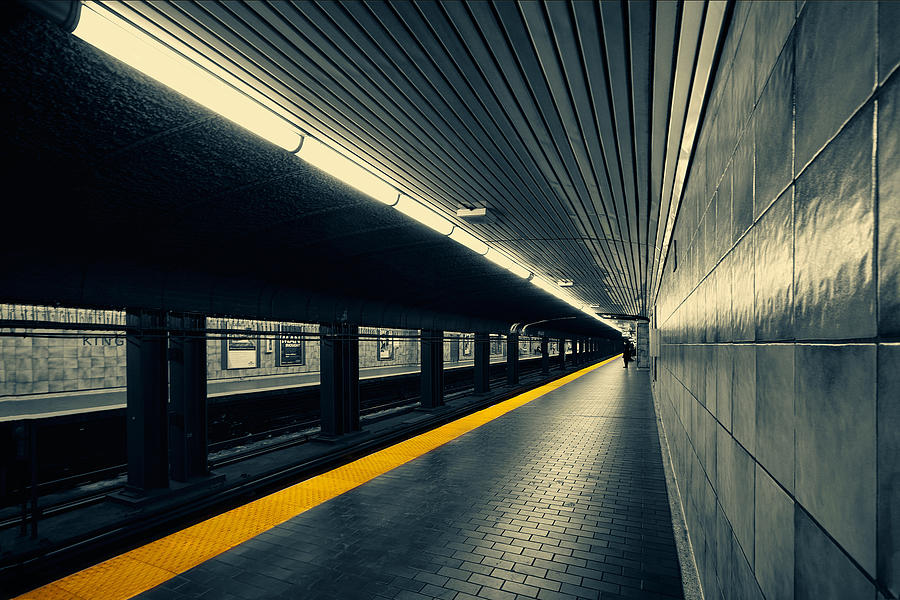
Where is `white ceiling lights`? white ceiling lights is located at coordinates (133, 54), (334, 161), (426, 221), (465, 243), (510, 263), (561, 298), (613, 338).